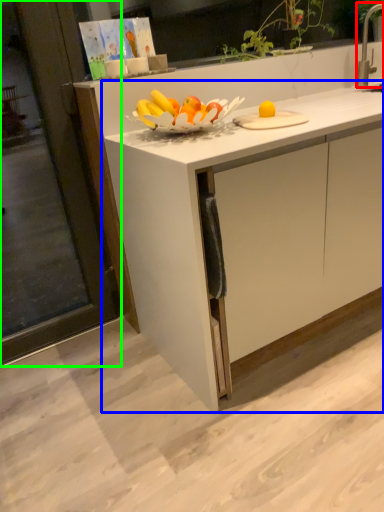
Question: Considering the real-world distances, which object is farthest from faucet (highlighted by a red box)? cabinetry (highlighted by a blue box) or screen door (highlighted by a green box)?

Choices:
 (A) cabinetry
 (B) screen door

Answer: (B)